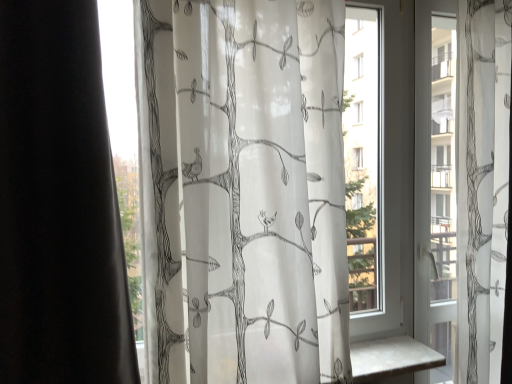
This screenshot has width=512, height=384. I want to click on translucent white fabric at center, so click(x=243, y=191).

What do you see at coordinates (243, 191) in the screenshot? This screenshot has width=512, height=384. I see `translucent white fabric at center` at bounding box center [243, 191].

Measure the distance between transparent glass window at right and camera.

A distance of 5.25 feet exists between transparent glass window at right and camera.

What do you see at coordinates (451, 166) in the screenshot? I see `transparent glass window at right` at bounding box center [451, 166].

Where is `transparent glass window at right`? Image resolution: width=512 pixels, height=384 pixels. transparent glass window at right is located at coordinates (451, 166).

At what (x,y) coordinates should I click in order to perform the action: click on translucent white fabric at center. Please return your answer as a coordinate pair (x, y). This screenshot has width=512, height=384. Looking at the image, I should click on (243, 191).

Considering the relative positions of transparent glass window at right and translucent white fabric at center in the image provided, is transparent glass window at right to the left or to the right of translucent white fabric at center?

Based on their positions, transparent glass window at right is located to the right of translucent white fabric at center.

Which is behind, transparent glass window at right or translucent white fabric at center?

Positioned behind is transparent glass window at right.

Is point (496, 133) closer or farther from the camera than point (302, 58)?

Point (496, 133) is positioned farther from the camera compared to point (302, 58).

From the image's perspective, who appears lower, transparent glass window at right or translucent white fabric at center?

translucent white fabric at center appears lower in the image.

From a real-world perspective, does transparent glass window at right sit lower than translucent white fabric at center?

Yes, from a real-world perspective, transparent glass window at right is under translucent white fabric at center.

Which object is thinner, transparent glass window at right or translucent white fabric at center?

With smaller width is transparent glass window at right.

Considering the relative sizes of transparent glass window at right and translucent white fabric at center in the image provided, is transparent glass window at right taller than translucent white fabric at center?

Correct, transparent glass window at right is much taller as translucent white fabric at center.

Considering the relative sizes of transparent glass window at right and translucent white fabric at center in the image provided, is transparent glass window at right bigger than translucent white fabric at center?

No.

Is transparent glass window at right located outside translucent white fabric at center?

Indeed, transparent glass window at right is completely outside translucent white fabric at center.

Is transparent glass window at right in contact with translucent white fabric at center?

No.

Is transparent glass window at right positioned with its back to translucent white fabric at center?

No, translucent white fabric at center is not at the back of transparent glass window at right.

What's the angular difference between transparent glass window at right and translucent white fabric at center's facing directions?

The angular difference between transparent glass window at right and translucent white fabric at center is 0.000504 degrees.

This screenshot has height=384, width=512. What are the coordinates of `window that appears above the translucent white fabric at center (from the image's perspective)` in the screenshot? It's located at (451, 166).

Does translucent white fabric at center appear on the left side of transparent glass window at right?

Correct, you'll find translucent white fabric at center to the left of transparent glass window at right.

Which object is more forward, translucent white fabric at center or transparent glass window at right?

translucent white fabric at center is more forward.

Is point (173, 115) positioned in front of point (481, 90)?

Yes, point (173, 115) is closer to viewer.

From the image's perspective, is translucent white fabric at center below transparent glass window at right?

Yes, from the image's perspective, translucent white fabric at center is below transparent glass window at right.

From a real-world perspective, who is located higher, translucent white fabric at center or transparent glass window at right?

In real-world perspective, translucent white fabric at center is above.

Does translucent white fabric at center have a lesser width compared to transparent glass window at right?

In fact, translucent white fabric at center might be wider than transparent glass window at right.

Considering the sizes of objects translucent white fabric at center and transparent glass window at right in the image provided, who is shorter, translucent white fabric at center or transparent glass window at right?

translucent white fabric at center is shorter.

Between translucent white fabric at center and transparent glass window at right, which one has smaller size?

Smaller between the two is transparent glass window at right.

Choose the correct answer: Is translucent white fabric at center inside transparent glass window at right or outside it?

The correct answer is: outside.

Is translucent white fabric at center in contact with transparent glass window at right?

translucent white fabric at center and transparent glass window at right are not in contact.

Is translucent white fabric at center oriented away from transparent glass window at right?

That's not correct — translucent white fabric at center is not looking away from transparent glass window at right.

What's the angular difference between translucent white fabric at center and transparent glass window at right's facing directions?

0.000504 degrees separate the facing orientations of translucent white fabric at center and transparent glass window at right.

Locate an element on the screen. curtain that is on the left side of transparent glass window at right is located at coordinates (243, 191).

Find the location of a particular element. This screenshot has width=512, height=384. curtain in front of the transparent glass window at right is located at coordinates (243, 191).

The width and height of the screenshot is (512, 384). I want to click on window behind the translucent white fabric at center, so click(451, 166).